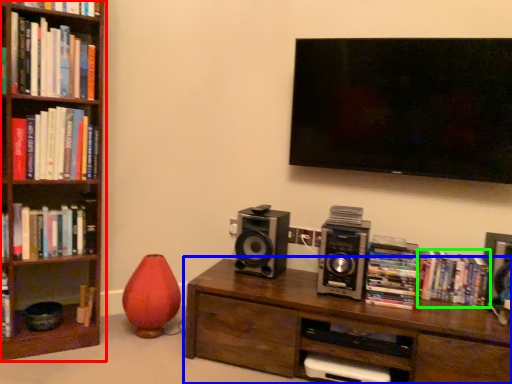
Question: Based on their relative distances, which object is nearer to bookcase (highlighted by a red box)? Choose from table (highlighted by a blue box) and book (highlighted by a green box).

Choices:
 (A) table
 (B) book

Answer: (A)